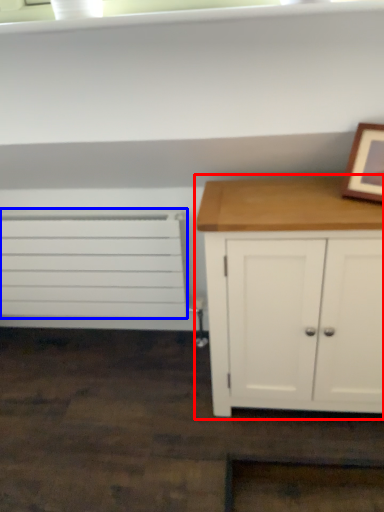
Question: Among these objects, which one is farthest to the camera, chest of drawers (highlighted by a red box) or drawer (highlighted by a blue box)?

Choices:
 (A) chest of drawers
 (B) drawer

Answer: (B)